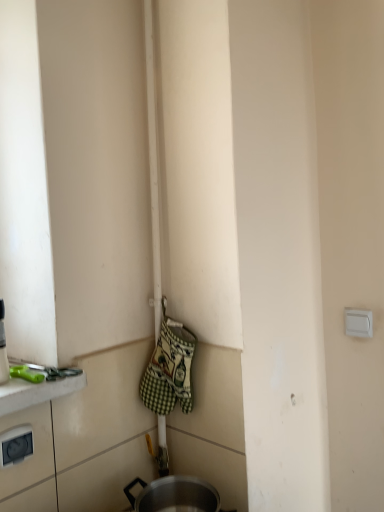
At what (x,y) coordinates should I click in order to perform the action: click on white plastic electric outlet at lower left, which is the second electric outlet from back to front. Please return your answer as a coordinate pair (x, y). Looking at the image, I should click on (15, 445).

This screenshot has height=512, width=384. What do you see at coordinates (358, 323) in the screenshot?
I see `white plastic electric outlet at upper right, placed as the 1th electric outlet when sorted from right to left` at bounding box center [358, 323].

Identify the location of green plastic scissors at lower left. (47, 370).

Where is `electric outlet directly beneath the green checkered fabric oven mitts at center (from a real-world perspective)`? electric outlet directly beneath the green checkered fabric oven mitts at center (from a real-world perspective) is located at coordinates (15, 445).

From the image's perspective, which object appears higher, white plastic electric outlet at lower left, which is the first electric outlet in bottom-to-top order, or green checkered fabric oven mitts at center?

green checkered fabric oven mitts at center.

Which is closer to the camera, (5, 453) or (182, 349)?

Clearly, point (5, 453) is closer to the camera than point (182, 349).

From a real-world perspective, is white plastic electric outlet at lower left, marked as the second electric outlet in a top-to-bottom arrangement, physically located above or below green plastic scissors at lower left?

Clearly, from a real-world perspective, white plastic electric outlet at lower left, marked as the second electric outlet in a top-to-bottom arrangement, is below green plastic scissors at lower left.

Based on the photo, would you say white plastic electric outlet at lower left, which is the second electric outlet from back to front, is to the left or to the right of green plastic scissors at lower left in the picture?

In the image, white plastic electric outlet at lower left, which is the second electric outlet from back to front, appears on the left side of green plastic scissors at lower left.

From the image's perspective, would you say white plastic electric outlet at lower left, the first electric outlet viewed from the left, is shown under green plastic scissors at lower left?

Yes, from the image's perspective, white plastic electric outlet at lower left, the first electric outlet viewed from the left, is below green plastic scissors at lower left.

Can you confirm if white plastic electric outlet at lower left, positioned as the 1th electric outlet in front-to-back order, is shorter than green plastic scissors at lower left?

In fact, white plastic electric outlet at lower left, positioned as the 1th electric outlet in front-to-back order, may be taller than green plastic scissors at lower left.

Does white plastic electric outlet at lower left, the first electric outlet viewed from the left, come behind white plastic electric outlet at upper right, positioned as the first electric outlet in back-to-front order?

No, white plastic electric outlet at lower left, the first electric outlet viewed from the left, is in front of white plastic electric outlet at upper right, positioned as the first electric outlet in back-to-front order.

You are a GUI agent. You are given a task and a screenshot of the screen. Output one action in this format:
    pyautogui.click(x=<x>, y=<y>)
    Task: Click on the electric outlet that appears behind the white plastic electric outlet at lower left, marked as the second electric outlet in a top-to-bottom arrangement
    The image size is (384, 512).
    Given the screenshot: What is the action you would take?
    pyautogui.click(x=358, y=323)

What's the angular difference between white plastic electric outlet at lower left, positioned as the 1th electric outlet in front-to-back order, and white plastic electric outlet at upper right, the 2th electric outlet viewed from the left,'s facing directions?

white plastic electric outlet at lower left, positioned as the 1th electric outlet in front-to-back order, and white plastic electric outlet at upper right, the 2th electric outlet viewed from the left, are facing 90.4 degrees away from each other.

Does white plastic electric outlet at lower left, marked as the second electric outlet in a top-to-bottom arrangement, have a greater height compared to white plastic electric outlet at upper right, the 1th electric outlet positioned from the top?

Correct, white plastic electric outlet at lower left, marked as the second electric outlet in a top-to-bottom arrangement, is much taller as white plastic electric outlet at upper right, the 1th electric outlet positioned from the top.

Which of these two, green checkered fabric oven mitts at center or green plastic scissors at lower left, is wider?

Wider between the two is green plastic scissors at lower left.

Based on their positions, is green checkered fabric oven mitts at center located to the left or right of green plastic scissors at lower left?

green checkered fabric oven mitts at center is to the right of green plastic scissors at lower left.

From the image's perspective, which one is positioned lower, green checkered fabric oven mitts at center or green plastic scissors at lower left?

green checkered fabric oven mitts at center, from the image's perspective.

I want to click on blanket that is under the green plastic scissors at lower left (from a real-world perspective), so click(x=169, y=370).

Which object is closer to the camera, white plastic electric outlet at upper right, positioned as the first electric outlet in back-to-front order, or green checkered fabric oven mitts at center?

green checkered fabric oven mitts at center is in front.

Is white plastic electric outlet at upper right, the 1th electric outlet positioned from the top, oriented towards green checkered fabric oven mitts at center?

No, white plastic electric outlet at upper right, the 1th electric outlet positioned from the top, is not turned towards green checkered fabric oven mitts at center.

Image resolution: width=384 pixels, height=512 pixels. Find the location of `electric outlet on the right of green checkered fabric oven mitts at center`. electric outlet on the right of green checkered fabric oven mitts at center is located at coordinates (358, 323).

Is point (353, 330) farther from viewer compared to point (160, 383)?

Yes, it is.

You are a GUI agent. You are given a task and a screenshot of the screen. Output one action in this format:
    pyautogui.click(x=<x>, y=<y>)
    Task: Click on the electric outlet in front of the white plastic electric outlet at upper right, positioned as the first electric outlet in back-to-front order
    This screenshot has width=384, height=512.
    Given the screenshot: What is the action you would take?
    pyautogui.click(x=15, y=445)

Is white plastic electric outlet at upper right, the 2th electric outlet viewed from the left, situated inside white plastic electric outlet at lower left, marked as the second electric outlet in a top-to-bottom arrangement, or outside?

white plastic electric outlet at upper right, the 2th electric outlet viewed from the left, cannot be found inside white plastic electric outlet at lower left, marked as the second electric outlet in a top-to-bottom arrangement.

Is white plastic electric outlet at upper right, which is the 2th electric outlet in bottom-to-top order, in contact with white plastic electric outlet at lower left, which is the second electric outlet from back to front?

white plastic electric outlet at upper right, which is the 2th electric outlet in bottom-to-top order, and white plastic electric outlet at lower left, which is the second electric outlet from back to front, are not in contact.

At what (x,y) coordinates should I click in order to perform the action: click on blanket above the white plastic electric outlet at lower left, marked as the second electric outlet in a top-to-bottom arrangement (from the image's perspective). Please return your answer as a coordinate pair (x, y). This screenshot has height=512, width=384. Looking at the image, I should click on (169, 370).

In terms of size, does green checkered fabric oven mitts at center appear bigger or smaller than white plastic electric outlet at lower left, the first electric outlet viewed from the left?

Considering their sizes, green checkered fabric oven mitts at center takes up more space than white plastic electric outlet at lower left, the first electric outlet viewed from the left.

Considering the sizes of green checkered fabric oven mitts at center and white plastic electric outlet at lower left, the first electric outlet viewed from the left, in the image, is green checkered fabric oven mitts at center wider or thinner than white plastic electric outlet at lower left, the first electric outlet viewed from the left,?

In the image, green checkered fabric oven mitts at center appears to be wider than white plastic electric outlet at lower left, the first electric outlet viewed from the left.

Who is shorter, green checkered fabric oven mitts at center or white plastic electric outlet at lower left, which is the second electric outlet from back to front?

Standing shorter between the two is white plastic electric outlet at lower left, which is the second electric outlet from back to front.

What are the coordinates of `electric outlet below the green checkered fabric oven mitts at center (from the image's perspective)` in the screenshot? It's located at (15, 445).

In order to click on electric outlet located in front of the green plastic scissors at lower left in this screenshot , I will do `click(15, 445)`.

Estimate the real-world distances between objects in this image. Which object is closer to green checkered fabric oven mitts at center, white plastic electric outlet at upper right, placed as the 1th electric outlet when sorted from right to left, or white plastic electric outlet at lower left, which is the first electric outlet in bottom-to-top order?

white plastic electric outlet at lower left, which is the first electric outlet in bottom-to-top order.

From the image, which object appears to be farther from green checkered fabric oven mitts at center, white plastic electric outlet at lower left, marked as the second electric outlet in a top-to-bottom arrangement, or white plastic electric outlet at upper right, placed as the 1th electric outlet when sorted from right to left?

white plastic electric outlet at upper right, placed as the 1th electric outlet when sorted from right to left, is further to green checkered fabric oven mitts at center.

Considering their positions, is green plastic scissors at lower left positioned closer to white plastic electric outlet at lower left, the first electric outlet viewed from the left, than green checkered fabric oven mitts at center?

The object closer to white plastic electric outlet at lower left, the first electric outlet viewed from the left, is green plastic scissors at lower left.

Looking at the image, which one is located closer to white plastic electric outlet at lower left, positioned as the 1th electric outlet in front-to-back order, green checkered fabric oven mitts at center or green plastic scissors at lower left?

The object closer to white plastic electric outlet at lower left, positioned as the 1th electric outlet in front-to-back order, is green plastic scissors at lower left.

Estimate the real-world distances between objects in this image. Which object is closer to green plastic scissors at lower left, white plastic electric outlet at lower left, which is the second electric outlet from back to front, or green checkered fabric oven mitts at center?

white plastic electric outlet at lower left, which is the second electric outlet from back to front.

When comparing their distances from green plastic scissors at lower left, does white plastic electric outlet at upper right, positioned as the first electric outlet in back-to-front order, or green checkered fabric oven mitts at center seem further?

The object further to green plastic scissors at lower left is white plastic electric outlet at upper right, positioned as the first electric outlet in back-to-front order.

Looking at the image, which one is located further to white plastic electric outlet at lower left, positioned as the 1th electric outlet in front-to-back order, white plastic electric outlet at upper right, placed as the 1th electric outlet when sorted from right to left, or green plastic scissors at lower left?

white plastic electric outlet at upper right, placed as the 1th electric outlet when sorted from right to left, is further to white plastic electric outlet at lower left, positioned as the 1th electric outlet in front-to-back order.

Based on their spatial positions, is green plastic scissors at lower left or white plastic electric outlet at lower left, which is the first electric outlet in bottom-to-top order, closer to white plastic electric outlet at upper right, positioned as the first electric outlet in back-to-front order?

green plastic scissors at lower left.

Find the location of a particular element. tool situated between white plastic electric outlet at lower left, marked as the second electric outlet in a top-to-bottom arrangement, and white plastic electric outlet at upper right, the 1th electric outlet positioned from the top, from left to right is located at coordinates (47, 370).

I want to click on tool between white plastic electric outlet at lower left, which is the second electric outlet from back to front, and green checkered fabric oven mitts at center, in the horizontal direction, so (47, 370).

You are a GUI agent. You are given a task and a screenshot of the screen. Output one action in this format:
    pyautogui.click(x=<x>, y=<y>)
    Task: Click on the blanket between green plastic scissors at lower left and white plastic electric outlet at upper right, marked as the second electric outlet in a front-to-back arrangement, in the horizontal direction
    
    Given the screenshot: What is the action you would take?
    pyautogui.click(x=169, y=370)

Identify the location of blanket between white plastic electric outlet at lower left, the first electric outlet viewed from the left, and white plastic electric outlet at upper right, which is the 2th electric outlet in bottom-to-top order, from left to right. (169, 370).